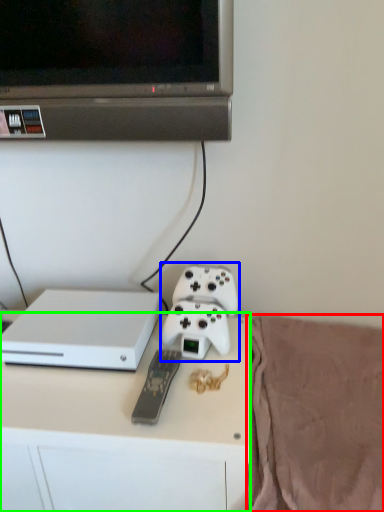
Question: Which object is positioned farthest from blanket (highlighted by a red box)? Select from game controller (highlighted by a blue box) and desk (highlighted by a green box).

Choices:
 (A) game controller
 (B) desk

Answer: (A)